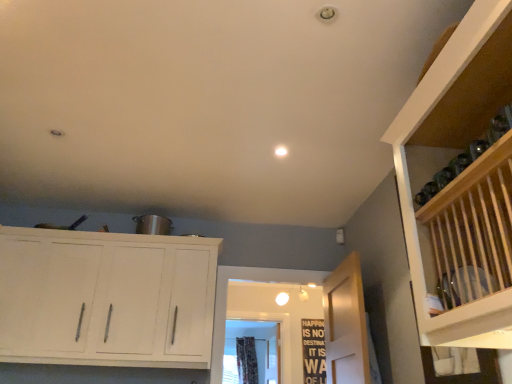
Question: Does black wood signboard at center touch floral fabric curtain at center?

Choices:
 (A) no
 (B) yes

Answer: (A)

Question: Can you confirm if black wood signboard at center is taller than floral fabric curtain at center?

Choices:
 (A) no
 (B) yes

Answer: (A)

Question: Is black wood signboard at center bigger than floral fabric curtain at center?

Choices:
 (A) no
 (B) yes

Answer: (A)

Question: Is floral fabric curtain at center surrounded by black wood signboard at center?

Choices:
 (A) yes
 (B) no

Answer: (B)

Question: From the image's perspective, is black wood signboard at center above floral fabric curtain at center?

Choices:
 (A) no
 (B) yes

Answer: (B)

Question: Based on their sizes in the image, would you say white wood cabinet at upper left is bigger or smaller than wooden door at center?

Choices:
 (A) big
 (B) small

Answer: (A)

Question: Which is correct: white wood cabinet at upper left is inside wooden door at center, or outside of it?

Choices:
 (A) inside
 (B) outside

Answer: (B)

Question: Considering the positions of point (180, 360) and point (342, 289), is point (180, 360) closer or farther from the camera than point (342, 289)?

Choices:
 (A) closer
 (B) farther

Answer: (A)

Question: Considering their positions, is white wood cabinet at upper left located in front of or behind wooden door at center?

Choices:
 (A) behind
 (B) front

Answer: (A)

Question: From a real-world perspective, is black wood signboard at center above or below floral fabric curtain at center?

Choices:
 (A) above
 (B) below

Answer: (B)

Question: In terms of size, does black wood signboard at center appear bigger or smaller than floral fabric curtain at center?

Choices:
 (A) big
 (B) small

Answer: (B)

Question: Would you say black wood signboard at center is to the left or to the right of floral fabric curtain at center in the picture?

Choices:
 (A) left
 (B) right

Answer: (B)

Question: Considering the positions of point (304, 347) and point (236, 337), is point (304, 347) closer or farther from the camera than point (236, 337)?

Choices:
 (A) closer
 (B) farther

Answer: (A)

Question: Considering the positions of black wood signboard at center and wooden door at center in the image, is black wood signboard at center bigger or smaller than wooden door at center?

Choices:
 (A) small
 (B) big

Answer: (A)

Question: Considering the relative positions of black wood signboard at center and wooden door at center in the image provided, is black wood signboard at center to the left or to the right of wooden door at center?

Choices:
 (A) right
 (B) left

Answer: (A)